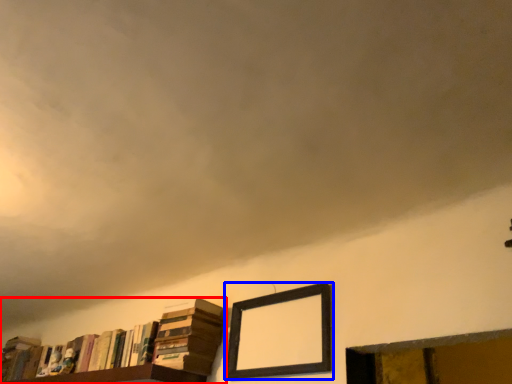
Question: Among these objects, which one is nearest to the camera, book (highlighted by a red box) or picture frame (highlighted by a blue box)?

Choices:
 (A) book
 (B) picture frame

Answer: (B)